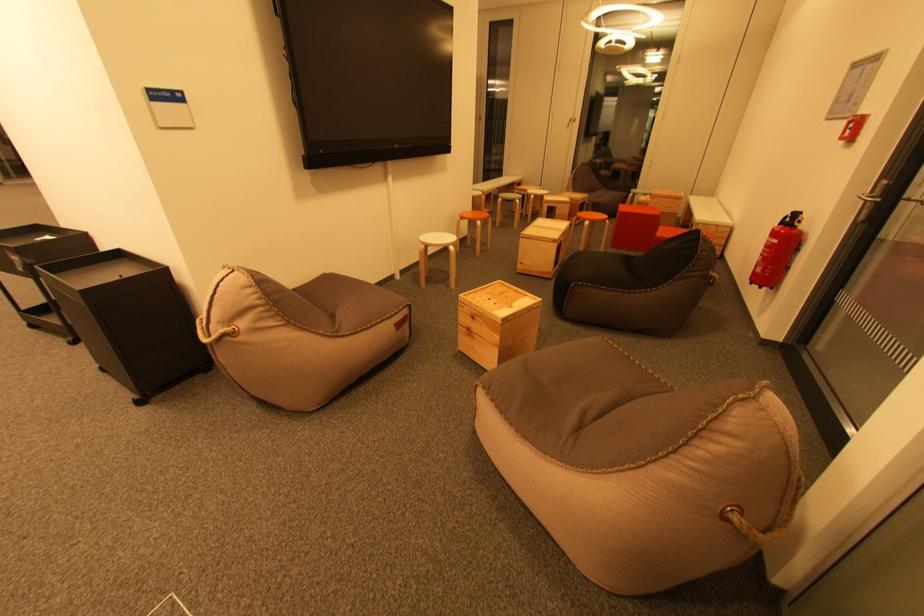
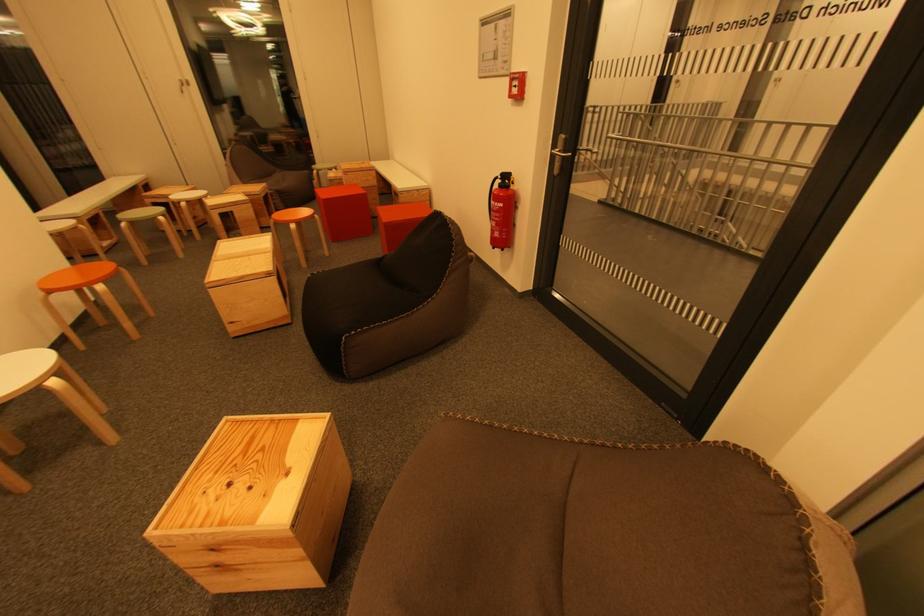
Question: Based on the continuous images, in which direction is the camera rotating? Reply with the corresponding letter.

Choices:
 (A) Left
 (B) Right
 (C) Up
 (D) Down

Answer: (B)